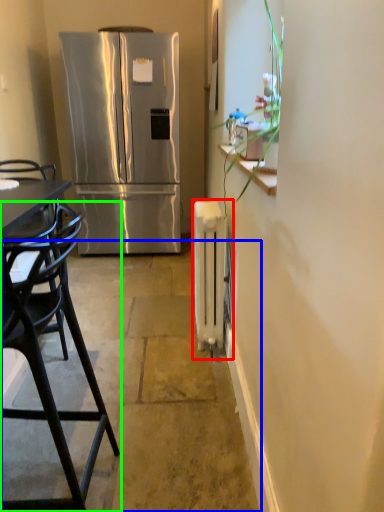
Question: Which object is the farthest from radiator (highlighted by a red box)? Choose among these: concrete (highlighted by a blue box) or chair (highlighted by a green box).

Choices:
 (A) concrete
 (B) chair

Answer: (B)